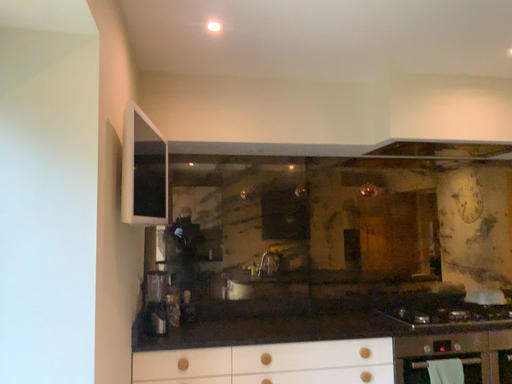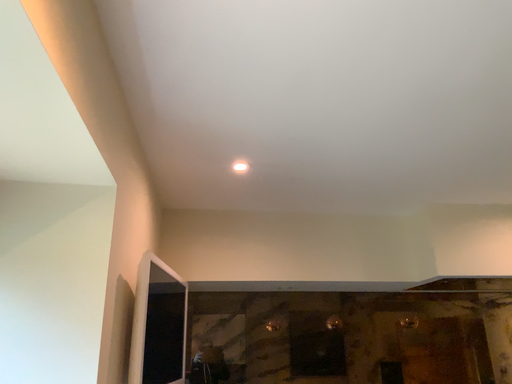
Question: How did the camera likely rotate when shooting the video?

Choices:
 (A) rotated downward
 (B) rotated upward

Answer: (B)